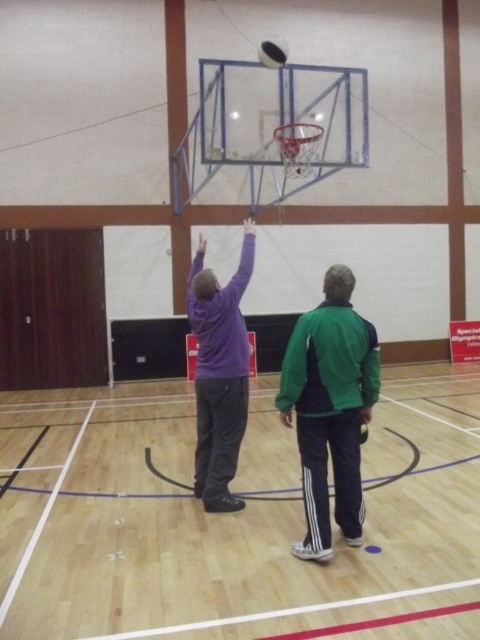
Question: Which of these objects is positioned closest to the wooden floor at center?

Choices:
 (A) glossy black basketball at upper center
 (B) green fabric jacket at center
 (C) purple fleece jacket at center

Answer: (C)

Question: Which object is closer to the camera taking this photo?

Choices:
 (A) wooden floor at center
 (B) green fabric jacket at center

Answer: (A)

Question: Is green fabric jacket at center wider than purple fleece jacket at center?

Choices:
 (A) yes
 (B) no

Answer: (A)

Question: Is wooden floor at center to the left of glossy black basketball at upper center from the viewer's perspective?

Choices:
 (A) no
 (B) yes

Answer: (B)

Question: Estimate the real-world distances between objects in this image. Which object is farther from the glossy black basketball at upper center?

Choices:
 (A) wooden floor at center
 (B) purple fleece jacket at center

Answer: (A)

Question: Is wooden floor at center below glossy black basketball at upper center?

Choices:
 (A) yes
 (B) no

Answer: (A)